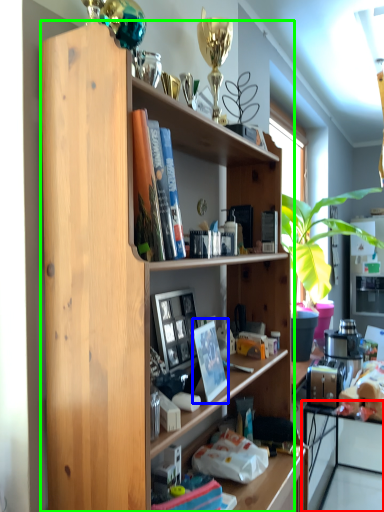
Question: Considering the real-world distances, which object is closest to computer (highlighted by a red box)? paperback book (highlighted by a blue box) or shelf (highlighted by a green box).

Choices:
 (A) paperback book
 (B) shelf

Answer: (B)